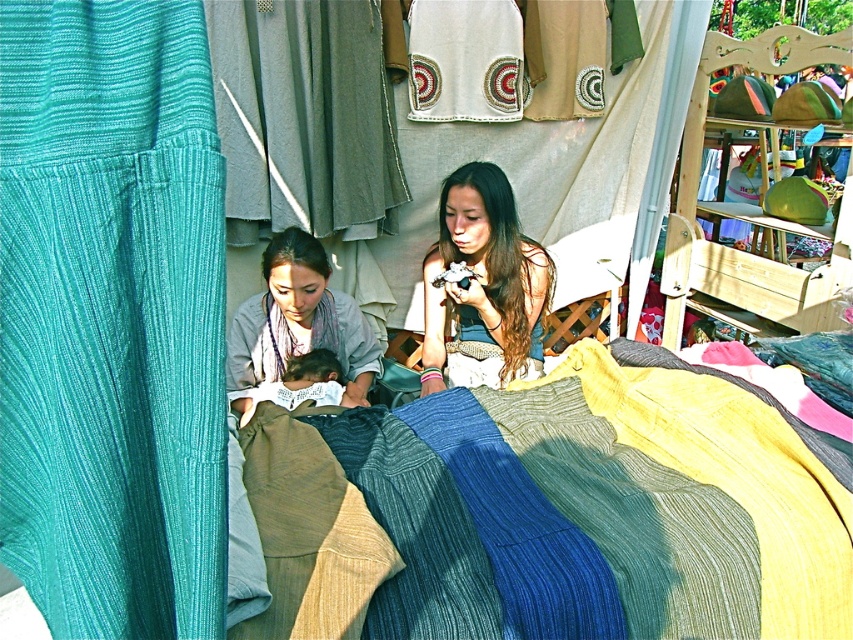
You are a customer at the market and want to buy a scarf and a fabric. You see the matte gray scarf at center and the soft white fabric at center. Which one is located higher?

The matte gray scarf at center is above the soft white fabric at center, so the matte gray scarf at center is higher.

You are a vendor at the market and need to display two items, the ribbed wool blanket at center and the soft white fabric at center. If you want to place them side by side on a narrow shelf, which item should you place first to ensure both fit?

The soft white fabric at center has a smaller width than the ribbed wool blanket at center. To fit both on the narrow shelf, place the wider ribbed wool blanket at center first, then the narrower soft white fabric at center next.